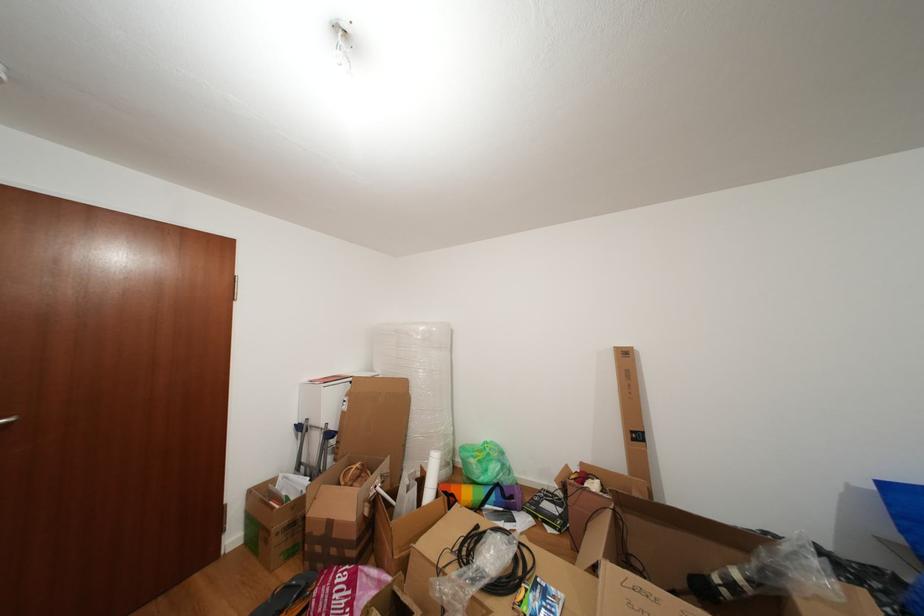
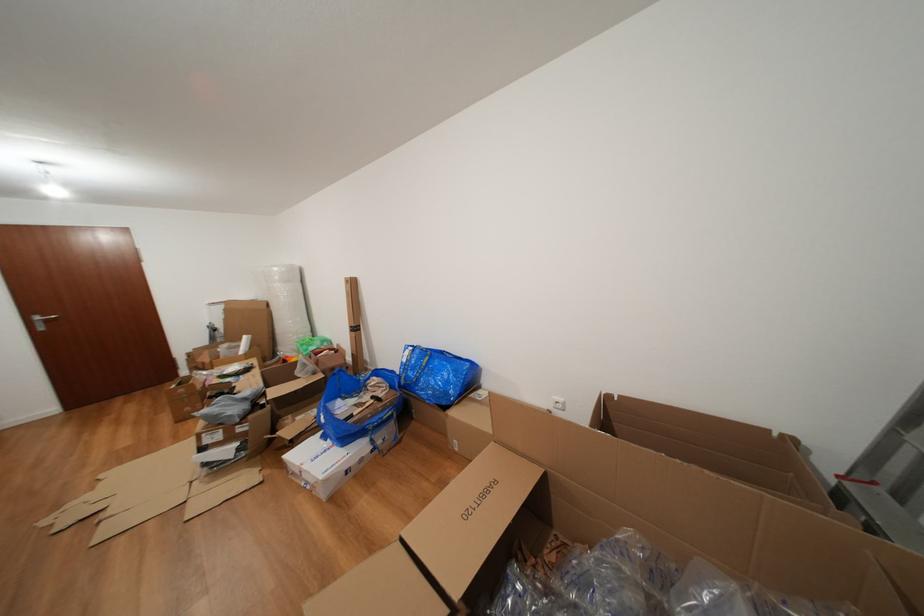
Question: In a continuous first-person perspective shot, in which direction is the camera moving?

Choices:
 (A) Left
 (B) Right
 (C) Forward
 (D) Backward

Answer: (B)